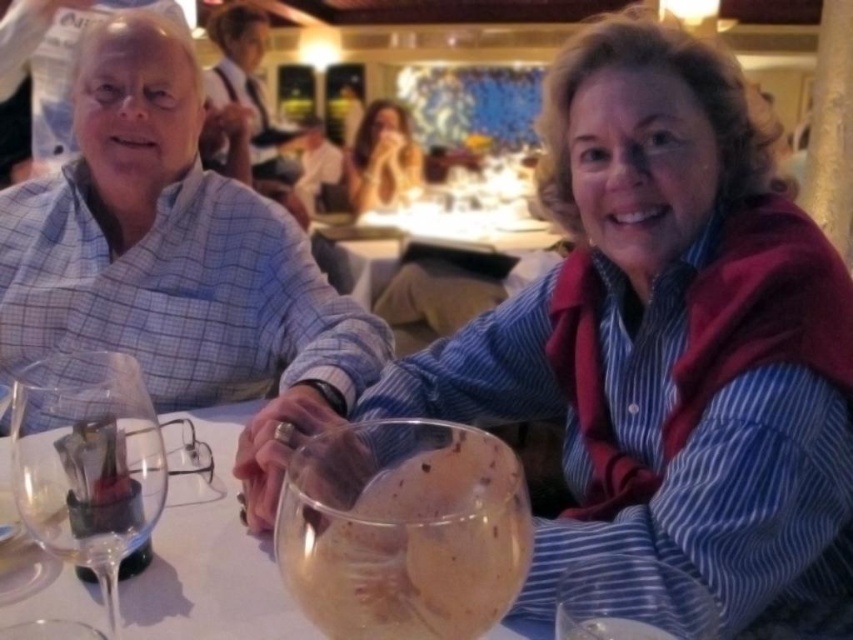
You are a photographer trying to capture a closeup of the blue striped shirt at center and the translucent glass bowl at center. If you want to ensure both are in focus, which object should you adjust your camera focus on first?

The blue striped shirt at center is bigger than the translucent glass bowl at center, so you should focus on the blue striped shirt at center first to ensure both are in focus.

You are a waiter at this restaurant and need to place a new menu between the translucent glass bowl at center and the light blue plaid shirt at center. Based on their positions, where should you place the menu?

The translucent glass bowl at center is in front of the light blue plaid shirt at center, so you should place the menu behind the translucent glass bowl at center, closer to the light blue plaid shirt at center to ensure it is accessible to the diner.